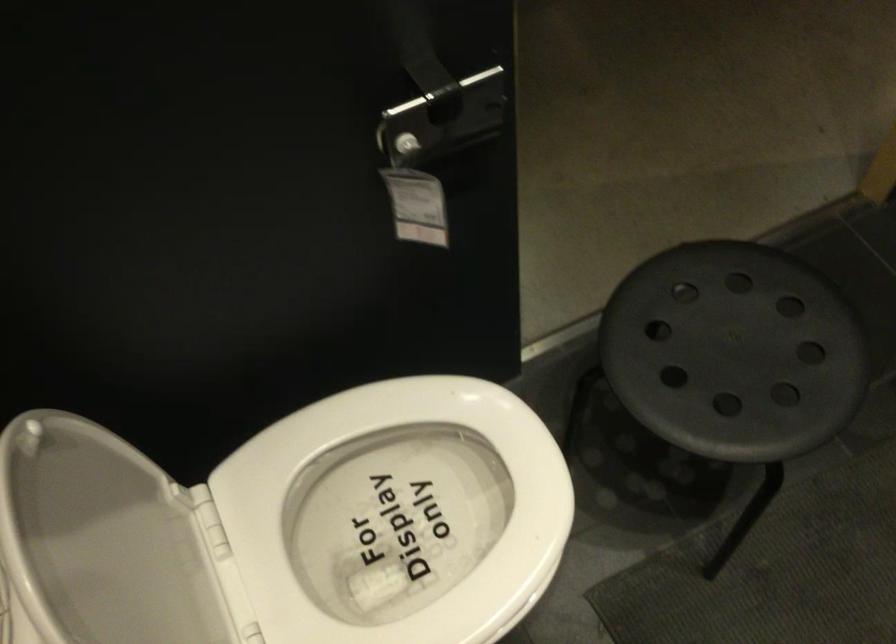
At what (x,y) coordinates should I click in order to perform the action: click on stool sitting surface. Please return your answer as a coordinate pair (x, y). The image size is (896, 644). Looking at the image, I should click on (734, 351).